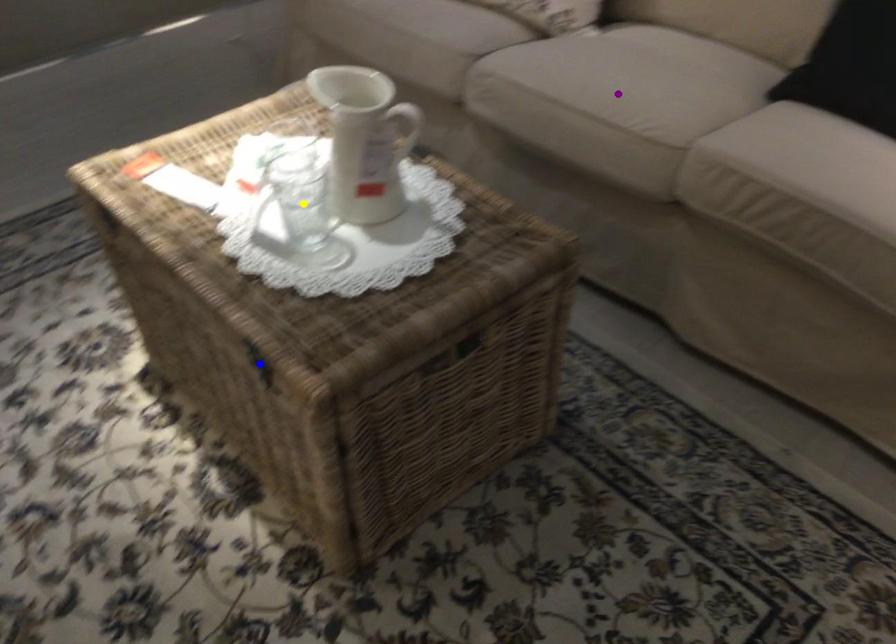
Order these from nearest to farthest:
- purple point
- yellow point
- blue point

1. blue point
2. yellow point
3. purple point